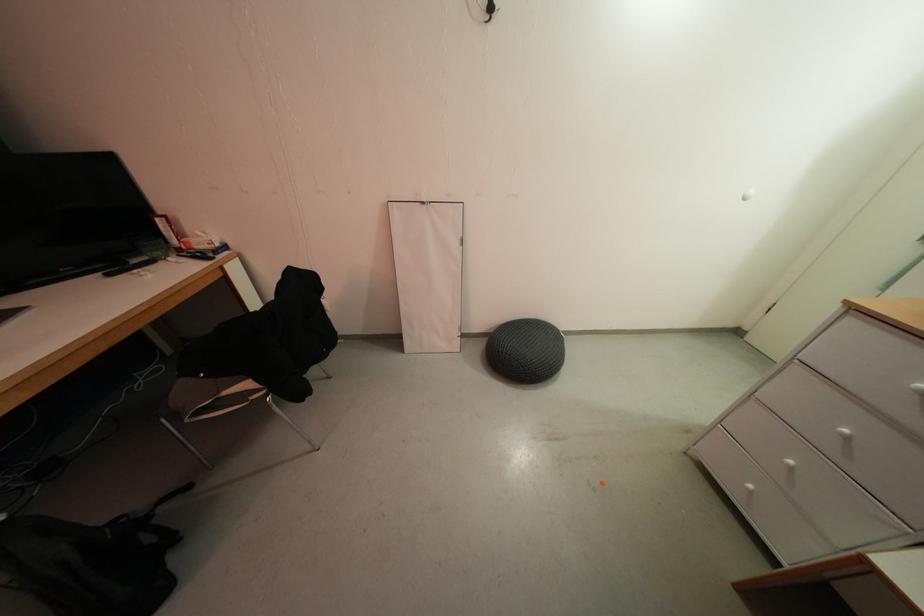
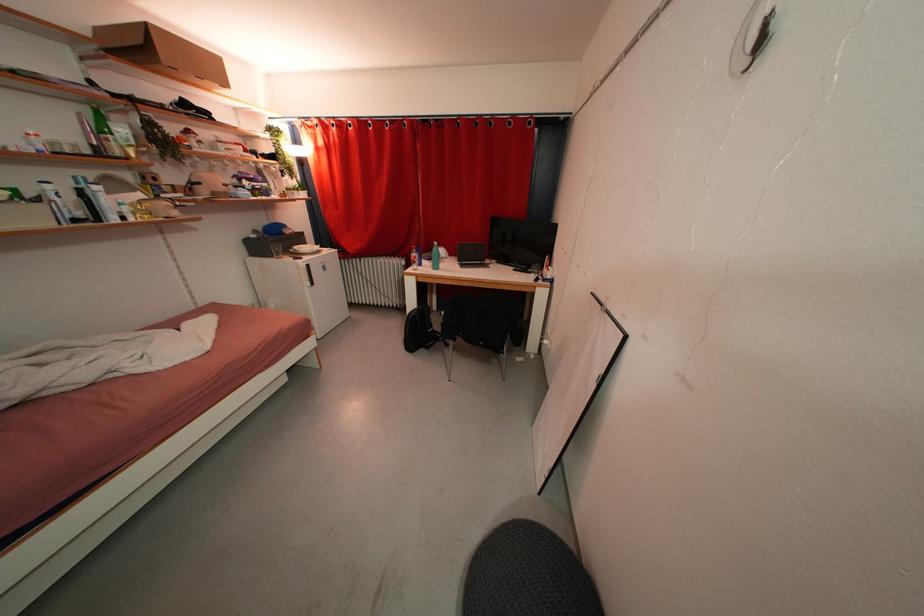
Where in the second image is the point corresponding to point 154,521 from the first image?

(444, 344)